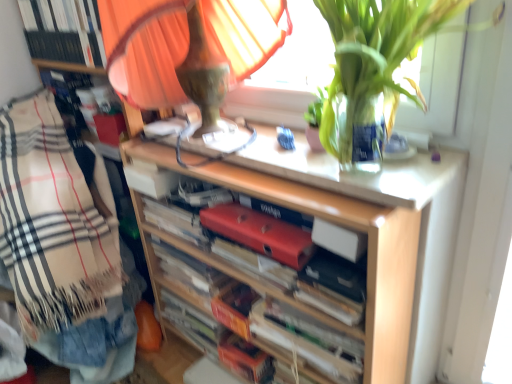
The height and width of the screenshot is (384, 512). What are the coordinates of `blank space situated above white paper book at center, which is counted as the 4th book, starting from the top (from a real-world perspective)` in the screenshot? It's located at click(x=310, y=320).